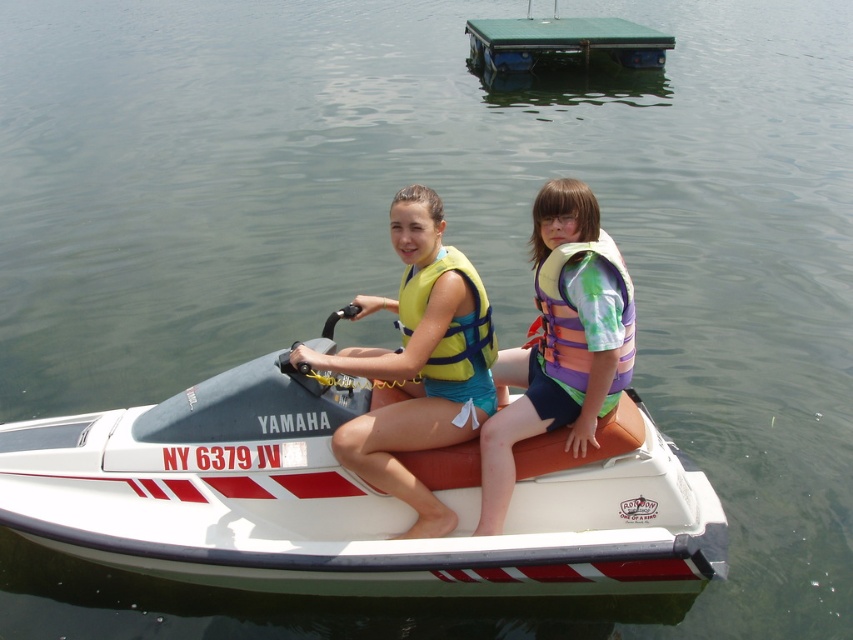
You are a safety inspector checking the Yamaha PWC. The Yamaha PWC has a maximum safe distance between the front rider and the back passenger of 3.5 meters. Is the current distance between the front rider and the back passenger on the white matte jet ski at center within the safe limit?

The distance between the front rider and the back passenger on the white matte jet ski at center is 3.93 meters, which exceeds the maximum safe distance of 3.5 meters. Therefore, the current distance is not within the safe limit.

You are a lifeguard observing the Yamaha PWC riders. The multicolored life vest at center is represented by point [561,340]. Where is the multicolored life vest at center located in relation to the Yamaha PWC?

The multicolored life vest at center is located at the coordinates point [561,340] on the Yamaha PWC.